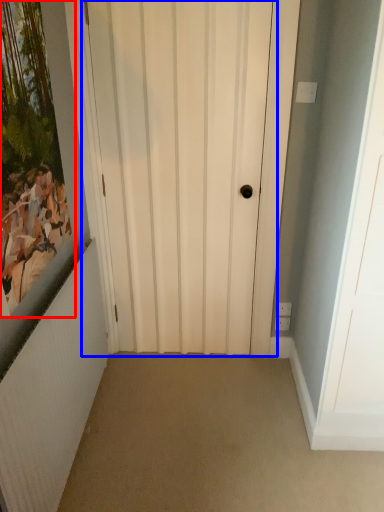
Question: Which of the following is the closest to the observer, picture frame (highlighted by a red box) or door (highlighted by a blue box)?

Choices:
 (A) picture frame
 (B) door

Answer: (A)